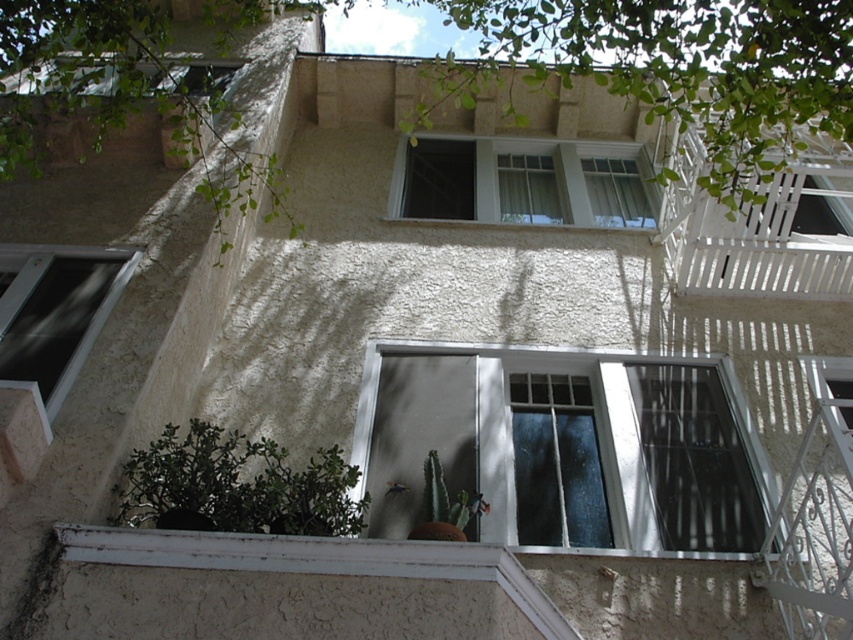
Does green leafy tree at upper left appear under matte black window at left?

Actually, green leafy tree at upper left is above matte black window at left.

Can you confirm if green leafy tree at upper left is bigger than matte black window at left?

Indeed, green leafy tree at upper left has a larger size compared to matte black window at left.

This screenshot has height=640, width=853. In order to click on green leafy tree at upper left in this screenshot , I will do `click(120, 93)`.

You are a GUI agent. You are given a task and a screenshot of the screen. Output one action in this format:
    pyautogui.click(x=<x>, y=<y>)
    Task: Click on the green leafy tree at upper left
    The height and width of the screenshot is (640, 853).
    Given the screenshot: What is the action you would take?
    pyautogui.click(x=120, y=93)

Which is behind, point (579, 486) or point (212, 96)?

Point (212, 96)

Consider the image. Does clear glass window at center have a lesser height compared to green leafy tree at upper left?

Yes.

You are a GUI agent. You are given a task and a screenshot of the screen. Output one action in this format:
    pyautogui.click(x=<x>, y=<y>)
    Task: Click on the clear glass window at center
    This screenshot has height=640, width=853.
    Given the screenshot: What is the action you would take?
    pyautogui.click(x=564, y=445)

Can you confirm if green leafy tree at upper center is bigger than white textured window at upper center?

Actually, green leafy tree at upper center might be smaller than white textured window at upper center.

Consider the image. Which is more to the right, green leafy tree at upper center or white textured window at upper center?

From the viewer's perspective, white textured window at upper center appears more on the right side.

At what (x,y) coordinates should I click in order to perform the action: click on green leafy tree at upper center. Please return your answer as a coordinate pair (x, y). Looking at the image, I should click on (671, 72).